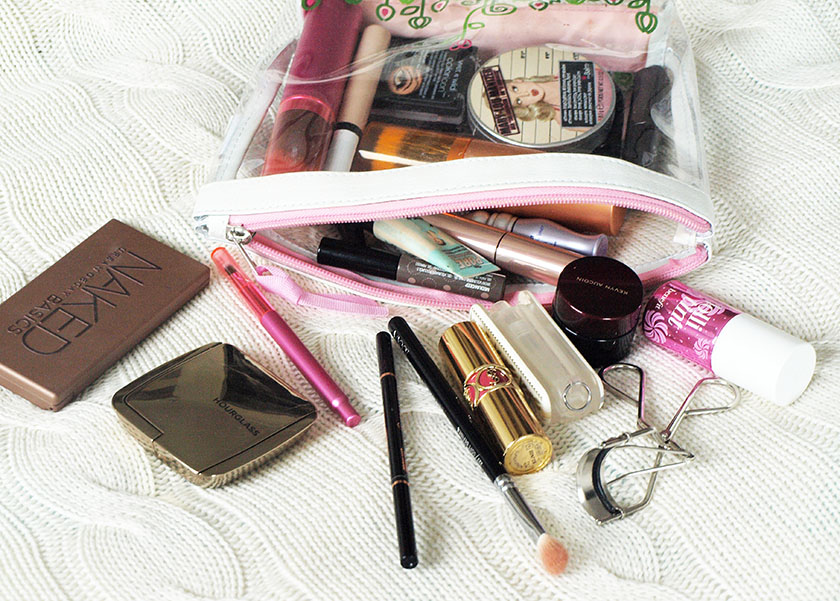
Find the location of a particular element. The height and width of the screenshot is (601, 840). clear makeup bag is located at coordinates (667, 147).